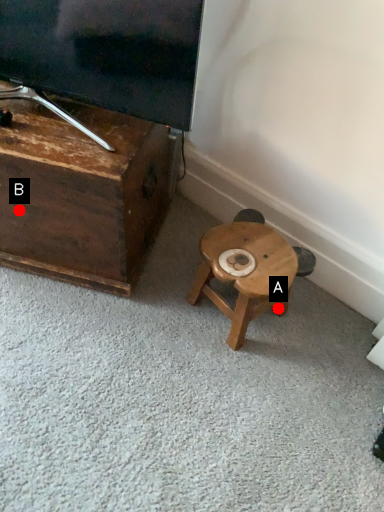
Question: Two points are circled on the image, labeled by A and B beside each circle. Which point is further to the camera?

Choices:
 (A) A is further
 (B) B is further

Answer: (A)